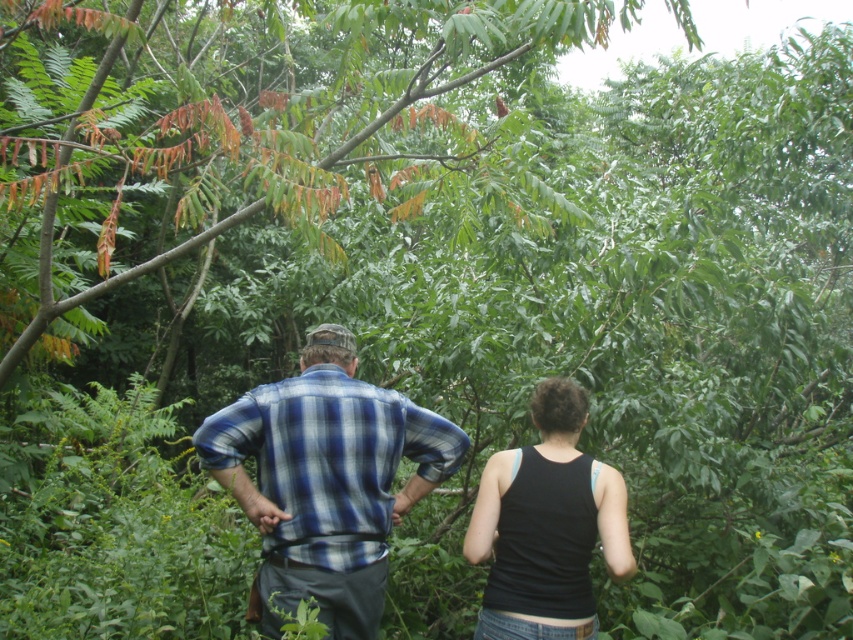
Who is taller, blue plaid shirt at center or black fabric tank top at center?

With more height is blue plaid shirt at center.

Can you confirm if blue plaid shirt at center is positioned above black fabric tank top at center?

Correct, blue plaid shirt at center is located above black fabric tank top at center.

Find the location of a particular element. This screenshot has height=640, width=853. blue plaid shirt at center is located at coordinates (325, 481).

Find the location of `blue plaid shirt at center`. blue plaid shirt at center is located at coordinates (325, 481).